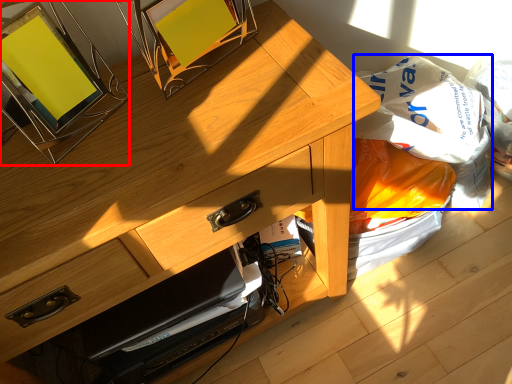
Question: Which point is closer to the camera, picture frame (highlighted by a red box) or grocery bag (highlighted by a blue box)?

Choices:
 (A) picture frame
 (B) grocery bag

Answer: (A)